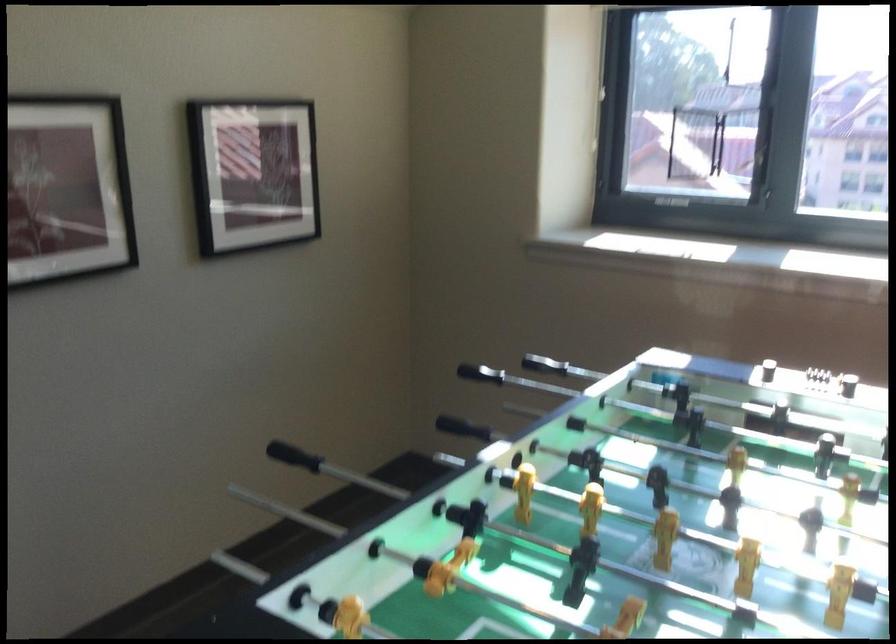
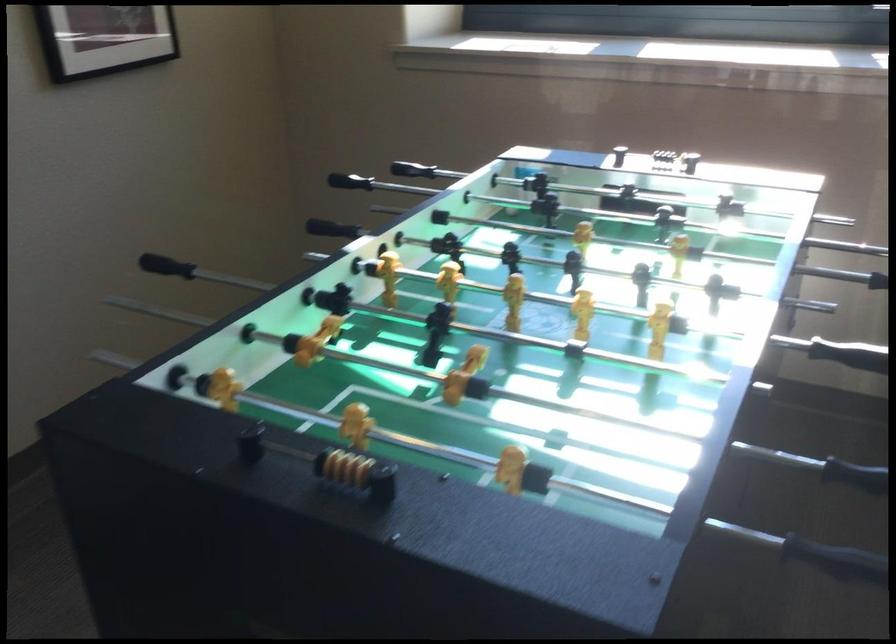
Question: The images are taken continuously from a first-person perspective. In which direction is your viewpoint rotating?

Choices:
 (A) Left
 (B) Right
 (C) Up
 (D) Down

Answer: (D)